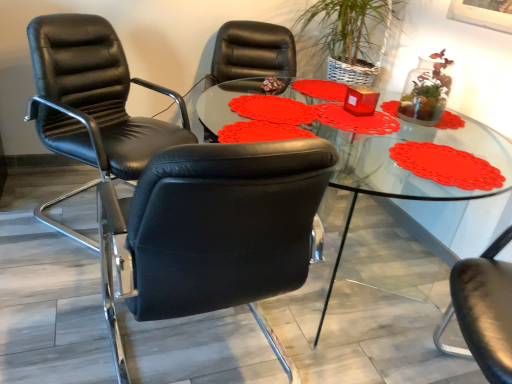
Locate an element on the screen. This screenshot has height=384, width=512. vacant area situated to the left side of black leather chair at left, marked as the first chair in a front-to-back arrangement is located at coordinates (58, 312).